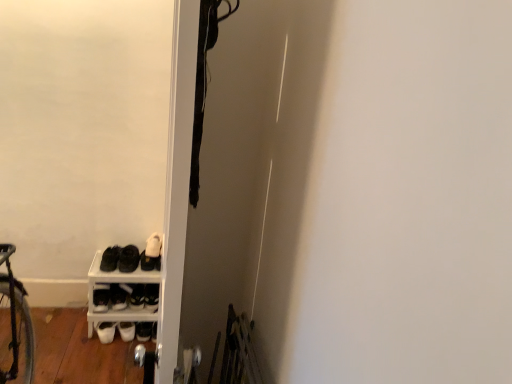
The height and width of the screenshot is (384, 512). I want to click on white leather shoe at lower left, the fourth footwear positioned from the left, so click(151, 297).

This screenshot has width=512, height=384. I want to click on white matte shoe at lower left, which ranks as the second footwear in right-to-left order, so click(x=152, y=253).

The width and height of the screenshot is (512, 384). Describe the element at coordinates (101, 297) in the screenshot. I see `white matte sneakers at lower left, positioned as the fourth footwear in right-to-left order` at that location.

At what (x,y) coordinates should I click in order to perform the action: click on white matte shoe rack at lower left. Please return your answer as a coordinate pair (x, y). Looking at the image, I should click on (122, 289).

How many degrees apart are the facing directions of black matte shoes at lower left, which is the second footwear from left to right, and white matte shoe at lower left, which ranks as the second footwear in right-to-left order?

black matte shoes at lower left, which is the second footwear from left to right, and white matte shoe at lower left, which ranks as the second footwear in right-to-left order, are facing 1.59 degrees away from each other.

Relative to white matte shoe at lower left, which ranks as the second footwear in right-to-left order, is black matte shoes at lower left, which is the second footwear from left to right, in front or behind?

black matte shoes at lower left, which is the second footwear from left to right, is in front of white matte shoe at lower left, which ranks as the second footwear in right-to-left order.

Measure the distance from black matte shoes at lower left, which is the second footwear from left to right, to white matte shoe at lower left, the third footwear viewed from the left.

black matte shoes at lower left, which is the second footwear from left to right, and white matte shoe at lower left, the third footwear viewed from the left, are 8.07 centimeters apart from each other.

Is black matte shoes at lower left, which appears as the third footwear when viewed from the right, turned away from white matte shoe at lower left, which ranks as the second footwear in right-to-left order?

No.

Is black matte shoes at lower left, which appears as the third footwear when viewed from the right, located outside white matte shoe rack at lower left?

Indeed, black matte shoes at lower left, which appears as the third footwear when viewed from the right, is completely outside white matte shoe rack at lower left.

Which is more to the right, black matte shoes at lower left, which appears as the third footwear when viewed from the right, or white matte shoe rack at lower left?

Positioned to the right is white matte shoe rack at lower left.

How different are the orientations of black matte shoes at lower left, which is the second footwear from left to right, and white matte shoe rack at lower left in degrees?

They differ by 0.0868 degrees in their facing directions.

I want to click on the 1st footwear behind when counting from the white matte shoe rack at lower left, so click(128, 259).

Could you measure the distance between white leather shoe at lower left, the fourth footwear positioned from the left, and white matte shoe at lower left, the third footwear viewed from the left?

white leather shoe at lower left, the fourth footwear positioned from the left, and white matte shoe at lower left, the third footwear viewed from the left, are 22.62 centimeters apart.

Between white leather shoe at lower left, the fourth footwear positioned from the left, and white matte shoe at lower left, the third footwear viewed from the left, which one has less height?

Standing shorter between the two is white leather shoe at lower left, the fourth footwear positioned from the left.

Which is behind, point (158, 293) or point (157, 244)?

The point (158, 293) is behind.

Is white leather shoe at lower left, the fourth footwear positioned from the left, located outside white matte shoe at lower left, the third footwear viewed from the left?

Absolutely, white leather shoe at lower left, the fourth footwear positioned from the left, is external to white matte shoe at lower left, the third footwear viewed from the left.

Considering the relative sizes of white matte shoe rack at lower left and black matte shoes at lower left, which appears as the third footwear when viewed from the right, in the image provided, is white matte shoe rack at lower left taller than black matte shoes at lower left, which appears as the third footwear when viewed from the right,?

Correct, white matte shoe rack at lower left is much taller as black matte shoes at lower left, which appears as the third footwear when viewed from the right.

Considering their positions, is white matte shoe rack at lower left located in front of or behind black matte shoes at lower left, which is the second footwear from left to right?

Visually, white matte shoe rack at lower left is located in front of black matte shoes at lower left, which is the second footwear from left to right.

Could you tell me if white matte shoe rack at lower left is turned towards black matte shoes at lower left, which is the second footwear from left to right?

No, white matte shoe rack at lower left is not facing towards black matte shoes at lower left, which is the second footwear from left to right.

What's the angular difference between white matte shoe rack at lower left and black matte shoes at lower left, which is the second footwear from left to right,'s facing directions?

white matte shoe rack at lower left and black matte shoes at lower left, which is the second footwear from left to right, are facing 0.0868 degrees away from each other.

In terms of height, does white matte shoe rack at lower left look taller or shorter compared to white matte shoe at lower left, the third footwear viewed from the left?

white matte shoe rack at lower left is taller than white matte shoe at lower left, the third footwear viewed from the left.

From the image's perspective, which object appears higher, white matte shoe rack at lower left or white matte shoe at lower left, which ranks as the second footwear in right-to-left order?

white matte shoe at lower left, which ranks as the second footwear in right-to-left order, from the image's perspective.

Would you say white matte shoe rack at lower left is inside or outside white matte shoe at lower left, which ranks as the second footwear in right-to-left order?

white matte shoe rack at lower left is spatially situated outside white matte shoe at lower left, which ranks as the second footwear in right-to-left order.

Is white matte shoe rack at lower left wider or thinner than white matte shoe at lower left, which ranks as the second footwear in right-to-left order?

In the image, white matte shoe rack at lower left appears to be wider than white matte shoe at lower left, which ranks as the second footwear in right-to-left order.

Identify the location of footwear below the white matte shoe rack at lower left (from a real-world perspective). (151, 297).

Can you confirm if white leather shoe at lower left, marked as the first footwear in a right-to-left arrangement, is wider than white matte shoe rack at lower left?

Incorrect, the width of white leather shoe at lower left, marked as the first footwear in a right-to-left arrangement, does not surpass that of white matte shoe rack at lower left.

Which is correct: white leather shoe at lower left, marked as the first footwear in a right-to-left arrangement, is inside white matte shoe rack at lower left, or outside of it?

white leather shoe at lower left, marked as the first footwear in a right-to-left arrangement, can be found inside white matte shoe rack at lower left.

In the image, is white matte shoe at lower left, which ranks as the second footwear in right-to-left order, positioned in front of or behind white matte shoe rack at lower left?

white matte shoe at lower left, which ranks as the second footwear in right-to-left order, is positioned farther from the viewer than white matte shoe rack at lower left.

Which is in front, point (160, 254) or point (122, 285)?

The point (160, 254) is closer.

From a real-world perspective, which is physically above, white matte shoe at lower left, which ranks as the second footwear in right-to-left order, or white matte shoe rack at lower left?

white matte shoe at lower left, which ranks as the second footwear in right-to-left order.

In the scene shown: Which object is positioned more to the left, white matte shoe at lower left, the third footwear viewed from the left, or white matte shoe rack at lower left?

From the viewer's perspective, white matte shoe rack at lower left appears more on the left side.

From the black matte shoes at lower left, which is the second footwear from left to right, count 2nd footwears backward and point to it. Please provide its 2D coordinates.

[(152, 253)]

You are a GUI agent. You are given a task and a screenshot of the screen. Output one action in this format:
    pyautogui.click(x=<x>, y=<y>)
    Task: Click on the footwear that is the 3rd object located above the white matte shoe rack at lower left (from the image's perspective)
    The image size is (512, 384).
    Given the screenshot: What is the action you would take?
    pyautogui.click(x=128, y=259)

From the image, which object appears to be farther from black matte shoes at lower left, which appears as the third footwear when viewed from the right, white matte shoe rack at lower left or white matte sneakers at lower left, positioned as the fourth footwear in right-to-left order?

white matte sneakers at lower left, positioned as the fourth footwear in right-to-left order.

When comparing their distances from white matte shoe at lower left, the third footwear viewed from the left, does white leather shoe at lower left, the fourth footwear positioned from the left, or black matte shoes at lower left, which is the second footwear from left to right, seem further?

white leather shoe at lower left, the fourth footwear positioned from the left, is positioned further to the anchor white matte shoe at lower left, the third footwear viewed from the left.

Looking at the image, which one is located further to white matte sneakers at lower left, the first footwear viewed from the left, white leather shoe at lower left, marked as the first footwear in a right-to-left arrangement, or white matte shoe rack at lower left?

white leather shoe at lower left, marked as the first footwear in a right-to-left arrangement, is further to white matte sneakers at lower left, the first footwear viewed from the left.

Looking at the image, which one is located further to black matte shoes at lower left, which appears as the third footwear when viewed from the right, white leather shoe at lower left, marked as the first footwear in a right-to-left arrangement, or white matte sneakers at lower left, the first footwear viewed from the left?

white matte sneakers at lower left, the first footwear viewed from the left, is positioned further to the anchor black matte shoes at lower left, which appears as the third footwear when viewed from the right.

From the image, which object appears to be farther from white matte shoe rack at lower left, white leather shoe at lower left, the fourth footwear positioned from the left, or white matte shoe at lower left, which ranks as the second footwear in right-to-left order?

white matte shoe at lower left, which ranks as the second footwear in right-to-left order.

Considering their positions, is white matte shoe at lower left, which ranks as the second footwear in right-to-left order, positioned closer to black matte shoes at lower left, which is the second footwear from left to right, than white matte sneakers at lower left, the first footwear viewed from the left?

white matte shoe at lower left, which ranks as the second footwear in right-to-left order, lies closer to black matte shoes at lower left, which is the second footwear from left to right, than the other object.

From the image, which object appears to be nearer to black matte shoes at lower left, which appears as the third footwear when viewed from the right, white matte shoe at lower left, which ranks as the second footwear in right-to-left order, or white matte shoe rack at lower left?

Among the two, white matte shoe at lower left, which ranks as the second footwear in right-to-left order, is located nearer to black matte shoes at lower left, which appears as the third footwear when viewed from the right.

Looking at the image, which one is located closer to white matte shoe at lower left, which ranks as the second footwear in right-to-left order, white matte shoe rack at lower left or white matte sneakers at lower left, the first footwear viewed from the left?

white matte shoe rack at lower left is positioned closer to the anchor white matte shoe at lower left, which ranks as the second footwear in right-to-left order.

This screenshot has width=512, height=384. In order to click on footwear situated between white matte sneakers at lower left, the first footwear viewed from the left, and white matte shoe at lower left, the third footwear viewed from the left, from left to right in this screenshot , I will do `click(128, 259)`.

Where is `shelf situated between white matte sneakers at lower left, the first footwear viewed from the left, and white matte shoe at lower left, the third footwear viewed from the left, from left to right`? shelf situated between white matte sneakers at lower left, the first footwear viewed from the left, and white matte shoe at lower left, the third footwear viewed from the left, from left to right is located at coordinates (122, 289).

Where is `footwear between white matte sneakers at lower left, positioned as the fourth footwear in right-to-left order, and white matte shoe rack at lower left, in the horizontal direction`? footwear between white matte sneakers at lower left, positioned as the fourth footwear in right-to-left order, and white matte shoe rack at lower left, in the horizontal direction is located at coordinates [x=128, y=259].

Image resolution: width=512 pixels, height=384 pixels. Identify the location of shelf between white matte sneakers at lower left, positioned as the fourth footwear in right-to-left order, and white leather shoe at lower left, the fourth footwear positioned from the left, from left to right. coord(122,289).